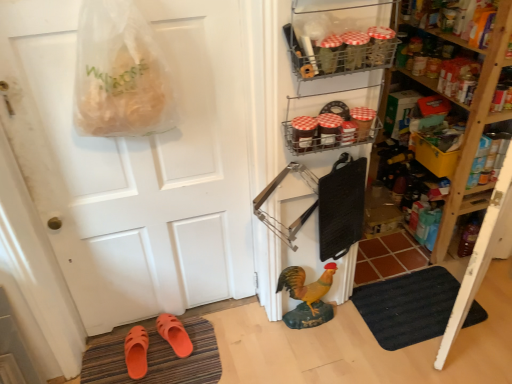
Locate an element on the screen. free spot above orange rubber doormat at lower left, positioned as the second doormat in right-to-left order (from a real-world perspective) is located at coordinates (148, 357).